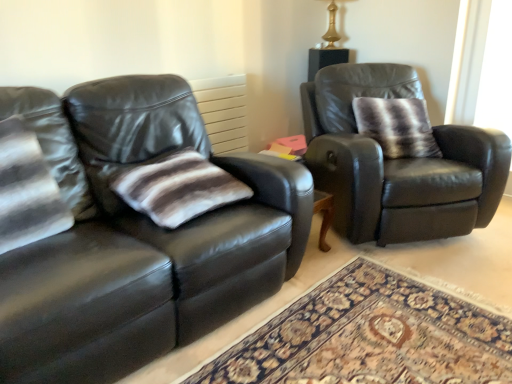
Question: Considering the positions of striped fur pillow at right, marked as the 1th pillow in a back-to-front arrangement, and striped fabric pillow at center, arranged as the 2th pillow when viewed from the right, in the image, is striped fur pillow at right, marked as the 1th pillow in a back-to-front arrangement, taller or shorter than striped fabric pillow at center, arranged as the 2th pillow when viewed from the right,?

Choices:
 (A) tall
 (B) short

Answer: (A)

Question: In the image, is striped fur pillow at right, arranged as the second pillow when viewed from the front, on the left side or the right side of striped fabric pillow at center, arranged as the 2th pillow when viewed from the right?

Choices:
 (A) left
 (B) right

Answer: (B)

Question: Considering the real-world distances, which object is closest to the striped fabric pillow at center, which ranks as the 1th pillow in bottom-to-top order?

Choices:
 (A) gold metallic table lamp at upper center
 (B) matte black couch at left
 (C) matte black leather armchair at right
 (D) striped fur pillow at right, marked as the 1th pillow in a back-to-front arrangement

Answer: (B)

Question: Estimate the real-world distances between objects in this image. Which object is closer to the striped fabric pillow at center, the 1th pillow viewed from the front?

Choices:
 (A) matte black couch at left
 (B) gold metallic table lamp at upper center
 (C) striped fur pillow at right, acting as the first pillow starting from the top
 (D) matte black leather armchair at right

Answer: (A)